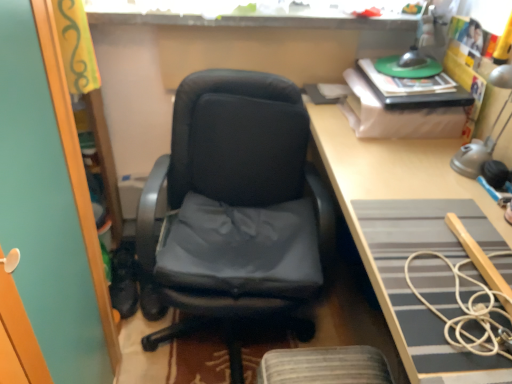
Locate an element on the screen. The image size is (512, 384). white cord at right is located at coordinates (470, 313).

The height and width of the screenshot is (384, 512). What do you see at coordinates (236, 211) in the screenshot?
I see `matte black office chair at center` at bounding box center [236, 211].

Find the location of a particular element. The height and width of the screenshot is (384, 512). white cord at right is located at coordinates (470, 313).

Does matte black office chair at center have a smaller size compared to metallic silver table lamp at upper right?

No, matte black office chair at center is not smaller than metallic silver table lamp at upper right.

Is matte black office chair at center situated inside metallic silver table lamp at upper right or outside?

matte black office chair at center is not inside metallic silver table lamp at upper right, it's outside.

Does point (271, 222) appear closer or farther from the camera than point (468, 151)?

Point (271, 222) is farther from the camera than point (468, 151).

Is matte black office chair at center to the right of metallic silver table lamp at upper right from the viewer's perspective?

No, matte black office chair at center is not to the right of metallic silver table lamp at upper right.

From the picture: Considering the sizes of objects light brown wooden desk at center and metallic silver table lamp at upper right in the image provided, who is shorter, light brown wooden desk at center or metallic silver table lamp at upper right?

Standing shorter between the two is metallic silver table lamp at upper right.

Is light brown wooden desk at center not near metallic silver table lamp at upper right?

No.

Is light brown wooden desk at center located outside metallic silver table lamp at upper right?

Yes, light brown wooden desk at center is located beyond the bounds of metallic silver table lamp at upper right.

From a real-world perspective, which object stands above the other?

metallic silver table lamp at upper right is physically above.

Which object is thinner, metallic silver table lamp at upper right or light brown wooden desk at center?

metallic silver table lamp at upper right is thinner.

How distant is metallic silver table lamp at upper right from light brown wooden desk at center?

metallic silver table lamp at upper right is 10.73 inches from light brown wooden desk at center.

Which is in front, point (474, 155) or point (374, 232)?

The point (374, 232) is closer to the camera.

From the image's perspective, is metallic silver table lamp at upper right located above or below light brown wooden desk at center?

metallic silver table lamp at upper right is above light brown wooden desk at center.

Find the location of a particular element. desk lying on the left of white cord at right is located at coordinates (408, 233).

Is light brown wooden desk at center turned away from white cord at right?

Yes, white cord at right is at the back of light brown wooden desk at center.

From the image's perspective, is light brown wooden desk at center beneath white cord at right?

No.

Is light brown wooden desk at center wider or thinner than white cord at right?

light brown wooden desk at center is wider than white cord at right.

Is metallic silver table lamp at upper right wider or thinner than matte black office chair at center?

Clearly, metallic silver table lamp at upper right has less width compared to matte black office chair at center.

How many degrees apart are the facing directions of metallic silver table lamp at upper right and matte black office chair at center?

There is a 79.5-degree angle between the facing directions of metallic silver table lamp at upper right and matte black office chair at center.

Are metallic silver table lamp at upper right and matte black office chair at center making contact?

No, metallic silver table lamp at upper right is not in contact with matte black office chair at center.

Is metallic silver table lamp at upper right further to camera compared to matte black office chair at center?

Yes, the depth of metallic silver table lamp at upper right is greater than that of matte black office chair at center.

Which of these two, matte black office chair at center or light brown wooden desk at center, stands taller?

Standing taller between the two is light brown wooden desk at center.

From a real-world perspective, is matte black office chair at center positioned above or below light brown wooden desk at center?

Clearly, from a real-world perspective, matte black office chair at center is below light brown wooden desk at center.

Does matte black office chair at center lie in front of light brown wooden desk at center?

No, it is behind light brown wooden desk at center.

In the scene shown: Is matte black office chair at center looking in the opposite direction of light brown wooden desk at center?

matte black office chair at center is not turned away from light brown wooden desk at center.

Which object is positioned more to the right, metallic silver table lamp at upper right or white cord at right?

metallic silver table lamp at upper right.

Can you confirm if metallic silver table lamp at upper right is wider than white cord at right?

No, metallic silver table lamp at upper right is not wider than white cord at right.

Can you confirm if metallic silver table lamp at upper right is taller than white cord at right?

Yes, metallic silver table lamp at upper right is taller than white cord at right.

The height and width of the screenshot is (384, 512). I want to click on chair in front of the metallic silver table lamp at upper right, so click(x=236, y=211).

Image resolution: width=512 pixels, height=384 pixels. Identify the location of table lamp that appears on the right of light brown wooden desk at center. (489, 131).

Based on their spatial positions, is matte black office chair at center or metallic silver table lamp at upper right closer to light brown wooden desk at center?

Based on the image, metallic silver table lamp at upper right appears to be nearer to light brown wooden desk at center.

When comparing their distances from metallic silver table lamp at upper right, does white cord at right or matte black office chair at center seem further?

matte black office chair at center is further to metallic silver table lamp at upper right.

From the picture: When comparing their distances from light brown wooden desk at center, does white cord at right or metallic silver table lamp at upper right seem further?

Among the two, metallic silver table lamp at upper right is located further to light brown wooden desk at center.

Based on their spatial positions, is white cord at right or light brown wooden desk at center further from metallic silver table lamp at upper right?

white cord at right.

Looking at the image, which one is located further to matte black office chair at center, light brown wooden desk at center or white cord at right?

white cord at right is positioned further to the anchor matte black office chair at center.

When comparing their distances from light brown wooden desk at center, does metallic silver table lamp at upper right or matte black office chair at center seem further?

Among the two, matte black office chair at center is located further to light brown wooden desk at center.

Based on their spatial positions, is light brown wooden desk at center or white cord at right further from metallic silver table lamp at upper right?

white cord at right lies further to metallic silver table lamp at upper right than the other object.

From the image, which object appears to be nearer to white cord at right, light brown wooden desk at center or matte black office chair at center?

The object closer to white cord at right is light brown wooden desk at center.

Identify the location of desk between matte black office chair at center and white cord at right. (408, 233).

At what (x,y) coordinates should I click in order to perform the action: click on rope located between light brown wooden desk at center and metallic silver table lamp at upper right in the depth direction. Please return your answer as a coordinate pair (x, y). Image resolution: width=512 pixels, height=384 pixels. Looking at the image, I should click on (470, 313).

The height and width of the screenshot is (384, 512). I want to click on desk between matte black office chair at center and metallic silver table lamp at upper right from left to right, so click(408, 233).

The width and height of the screenshot is (512, 384). What are the coordinates of `rope between matte black office chair at center and metallic silver table lamp at upper right in the horizontal direction` in the screenshot? It's located at (470, 313).